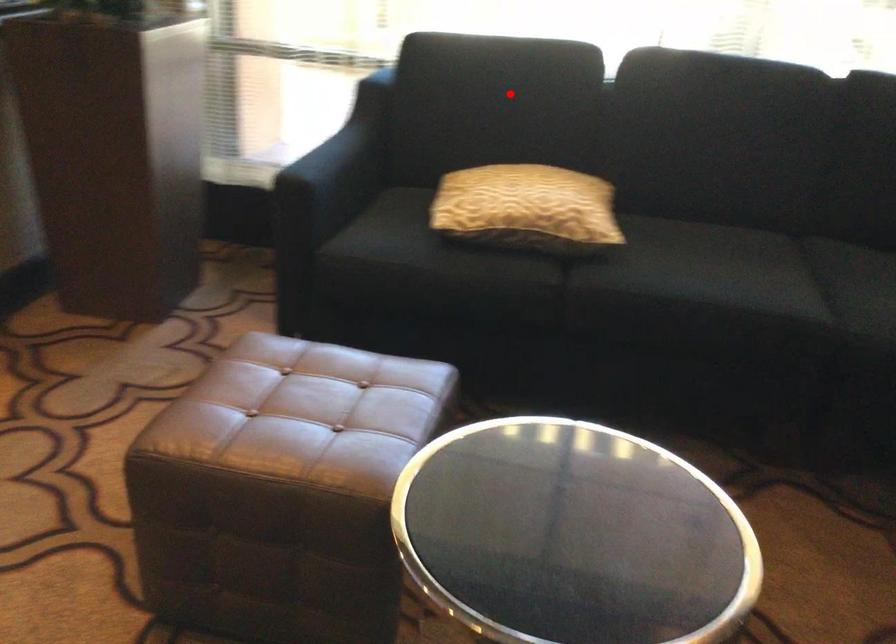
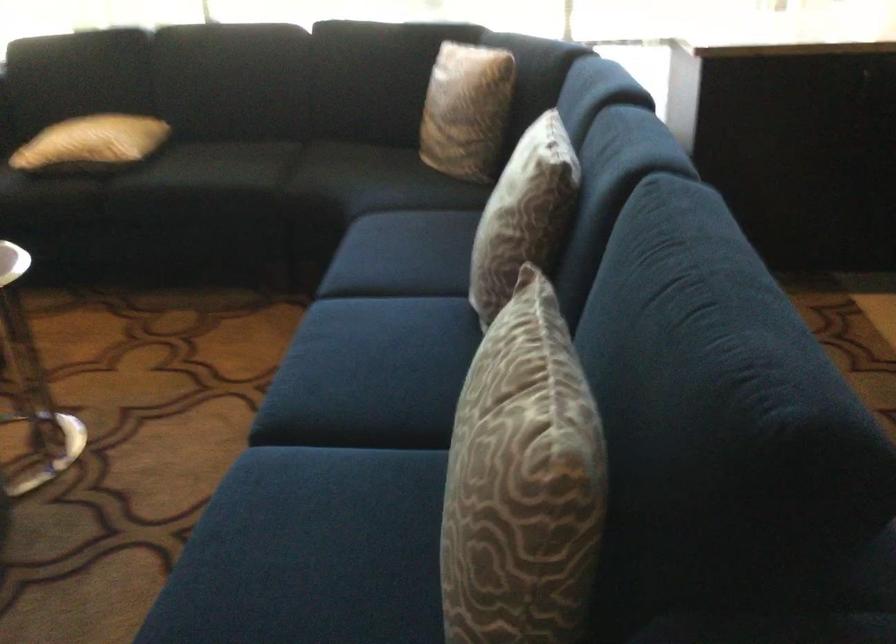
Question: I am providing you with two images of the same scene from different viewpoints. In image1, a red point is highlighted. Considering the same 3D point in image2, which of the following is correct?

Choices:
 (A) It is closer
 (B) It is farther

Answer: (B)